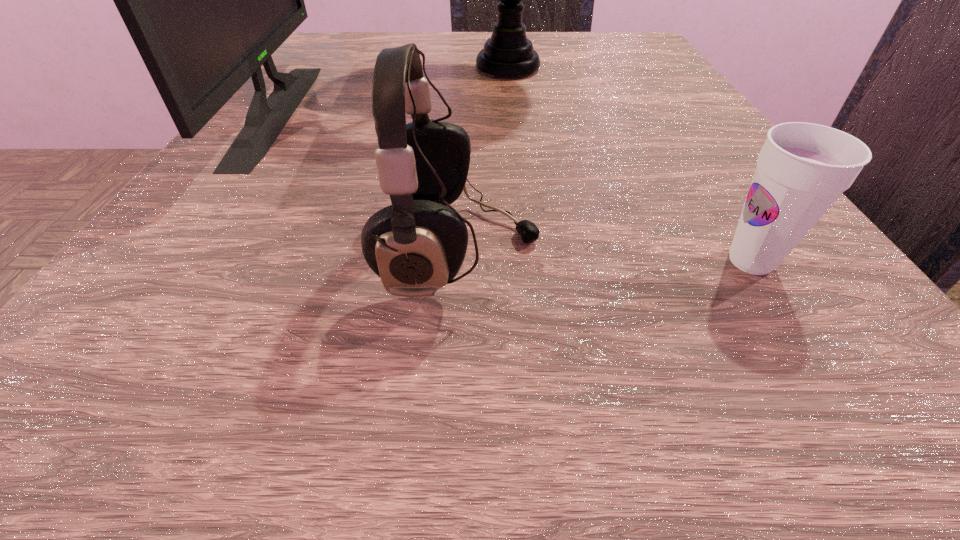
This screenshot has width=960, height=540. I want to click on lamp, so click(508, 52).

Identify the location of monitor. Image resolution: width=960 pixels, height=540 pixels. (207, 0).

What are the coordinates of `the leftmost object` in the screenshot? It's located at (207, 0).

I want to click on headset, so click(417, 245).

You are a GUI agent. You are given a task and a screenshot of the screen. Output one action in this format:
    pyautogui.click(x=<x>, y=<y>)
    Task: Click on the shortest object
    This screenshot has height=540, width=960.
    Given the screenshot: What is the action you would take?
    pyautogui.click(x=802, y=169)

You are a GUI agent. You are given a task and a screenshot of the screen. Output one action in this format:
    pyautogui.click(x=<x>, y=<y>)
    Task: Click on the rightmost object
    The width and height of the screenshot is (960, 540).
    Given the screenshot: What is the action you would take?
    pyautogui.click(x=802, y=169)

Where is `vacant space situated 0.320m on the front of the lamp`? The height and width of the screenshot is (540, 960). vacant space situated 0.320m on the front of the lamp is located at coordinates (528, 241).

Image resolution: width=960 pixels, height=540 pixels. What are the coordinates of `free space located 0.080m on the front-facing side of the monitor` in the screenshot? It's located at (349, 112).

The image size is (960, 540). I want to click on free space located 0.200m with the microphone on the side of the headset, so 748,251.

At what (x,y) coordinates should I click in order to perform the action: click on vacant region located 0.190m on the back of the rightmost object. Please return your answer as a coordinate pair (x, y). The image size is (960, 540). Looking at the image, I should click on (676, 144).